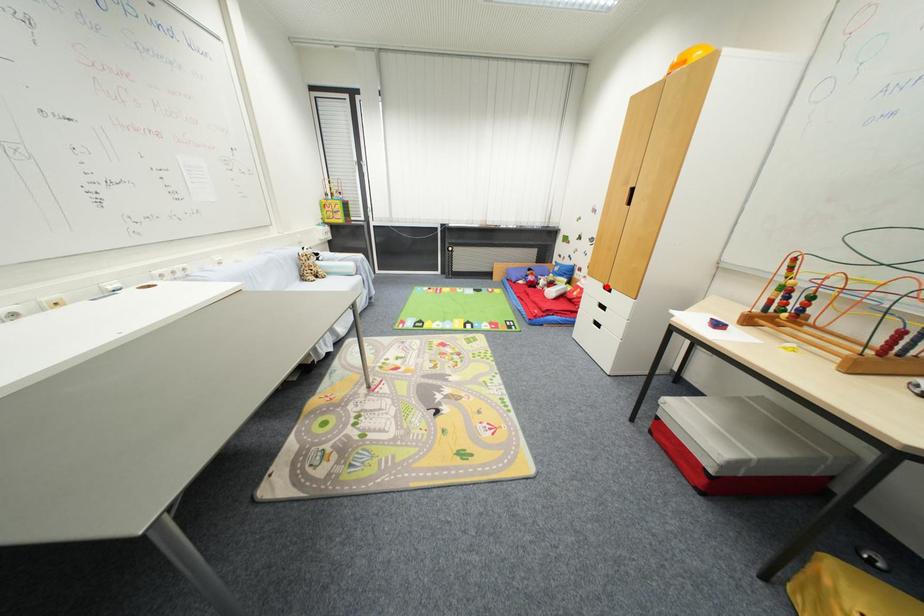
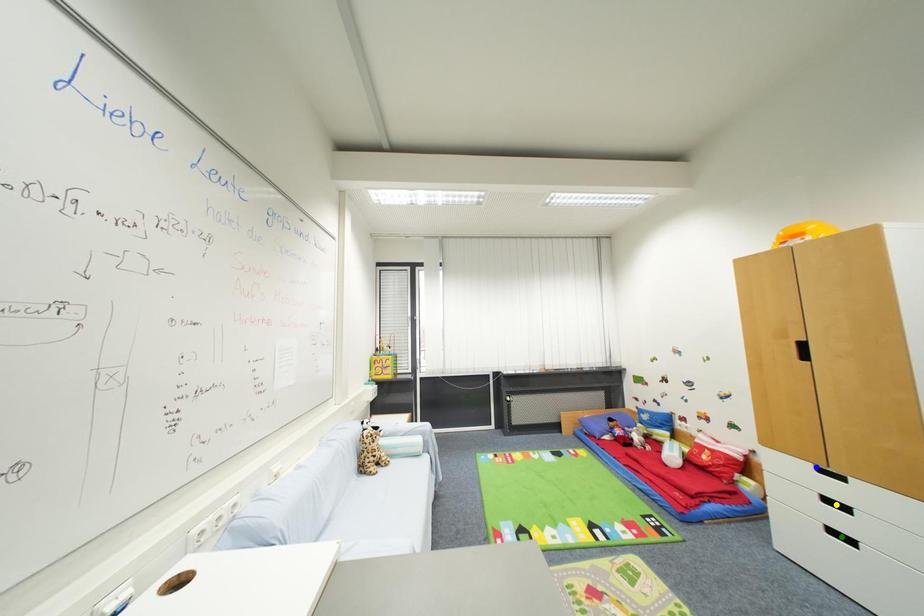
Question: I am providing you with two images of the same scene from different viewpoints. A red point is marked on the first image. You are given multiple points on the second image. In image 2, which mark is for the same physical point as the one in image 1?

Choices:
 (A) blue point
 (B) green point
 (C) yellow point

Answer: (A)